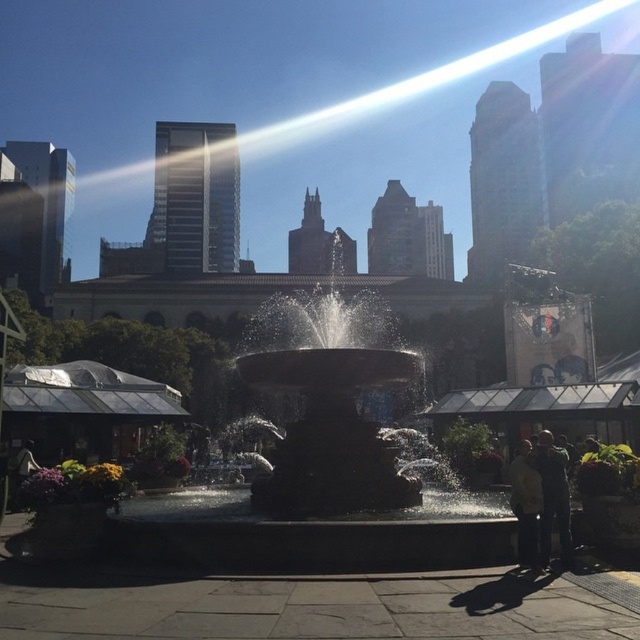
Question: Among these points, which one is nearest to the camera?

Choices:
 (A) (547, 448)
 (B) (316, 460)
 (C) (532, 522)

Answer: (C)

Question: Which point is closer to the camera taking this photo?

Choices:
 (A) (536, 480)
 (B) (316, 362)
 (C) (552, 445)

Answer: (A)

Question: Does dark gray jacket at lower right appear under light beige jacket at lower right?

Choices:
 (A) yes
 (B) no

Answer: (B)

Question: Does dark gray jacket at lower right appear on the left side of light beige jacket at lower right?

Choices:
 (A) no
 (B) yes

Answer: (A)

Question: Which point appears closest to the camera in this image?

Choices:
 (A) (556, 486)
 (B) (518, 483)
 (C) (326, 397)

Answer: (B)

Question: Does dark gray stone fountain at center appear on the left side of light beige jacket at lower right?

Choices:
 (A) no
 (B) yes

Answer: (B)